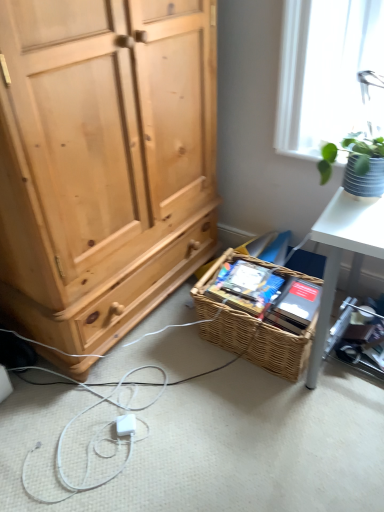
Question: Is the position of white plastic desk at right more distant than that of textured gray pot at upper right?

Choices:
 (A) no
 (B) yes

Answer: (B)

Question: Can you confirm if white plastic desk at right is shorter than textured gray pot at upper right?

Choices:
 (A) yes
 (B) no

Answer: (B)

Question: Is white plastic desk at right completely or partially outside of textured gray pot at upper right?

Choices:
 (A) no
 (B) yes

Answer: (B)

Question: Is white plastic desk at right facing towards textured gray pot at upper right?

Choices:
 (A) yes
 (B) no

Answer: (B)

Question: Is white plastic desk at right positioned with its back to textured gray pot at upper right?

Choices:
 (A) no
 (B) yes

Answer: (A)

Question: Does white plastic desk at right have a greater height compared to textured gray pot at upper right?

Choices:
 (A) no
 (B) yes

Answer: (B)

Question: Can you confirm if woven brown picnic basket at lower center is taller than white plastic desk at right?

Choices:
 (A) no
 (B) yes

Answer: (B)

Question: Does woven brown picnic basket at lower center have a larger size compared to white plastic desk at right?

Choices:
 (A) no
 (B) yes

Answer: (B)

Question: Can you confirm if woven brown picnic basket at lower center is smaller than white plastic desk at right?

Choices:
 (A) no
 (B) yes

Answer: (A)

Question: From the image's perspective, is woven brown picnic basket at lower center under white plastic desk at right?

Choices:
 (A) no
 (B) yes

Answer: (A)

Question: Does woven brown picnic basket at lower center have a lesser height compared to white plastic desk at right?

Choices:
 (A) no
 (B) yes

Answer: (A)

Question: Can we say woven brown picnic basket at lower center lies outside white plastic desk at right?

Choices:
 (A) yes
 (B) no

Answer: (A)

Question: Is textured gray pot at upper right at the right side of white plastic desk at right?

Choices:
 (A) no
 (B) yes

Answer: (A)